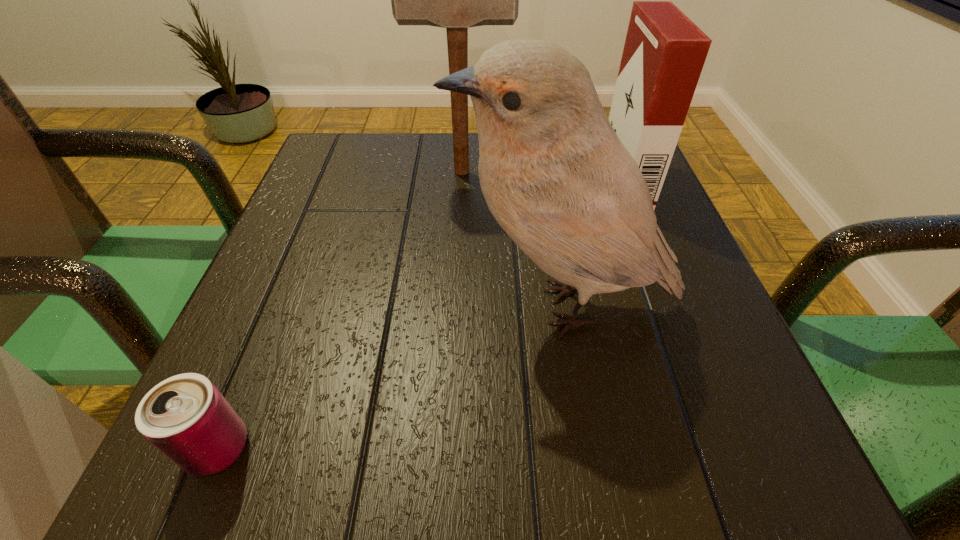
This screenshot has width=960, height=540. I want to click on free space between the mallet and the leftmost object, so (340, 310).

At what (x,y) coordinates should I click in order to perform the action: click on free space between the can and the parakeet. Please return your answer as a coordinate pair (x, y). The width and height of the screenshot is (960, 540). Looking at the image, I should click on (390, 377).

Point out which object is positioned as the nearest to the mallet. Please provide its 2D coordinates. Your answer should be formatted as a tuple, i.e. [(x, y)], where the tuple contains the x and y coordinates of a point satisfying the conditions above.

[(664, 53)]

The image size is (960, 540). In order to click on object that ranks as the closest to the cigarette_case in this screenshot , I will do `click(554, 174)`.

At what (x,y) coordinates should I click in order to perform the action: click on vacant point that satisfies the following two spatial constraints: 1. on the face of the third farthest object; 2. on the front side of the shortest object. Please return your answer as a coordinate pair (x, y). The height and width of the screenshot is (540, 960). Looking at the image, I should click on (586, 448).

This screenshot has width=960, height=540. What are the coordinates of `blank space that satisfies the following two spatial constraints: 1. on the face of the third farthest object; 2. on the front side of the nearest object` in the screenshot? It's located at (586, 448).

Locate an element on the screen. The width and height of the screenshot is (960, 540). vacant space that satisfies the following two spatial constraints: 1. on the face of the second nearest object; 2. on the front side of the nearest object is located at coordinates (586, 448).

Identify the location of blank space that satisfies the following two spatial constraints: 1. on the face of the third farthest object; 2. on the front side of the leftmost object. (586, 448).